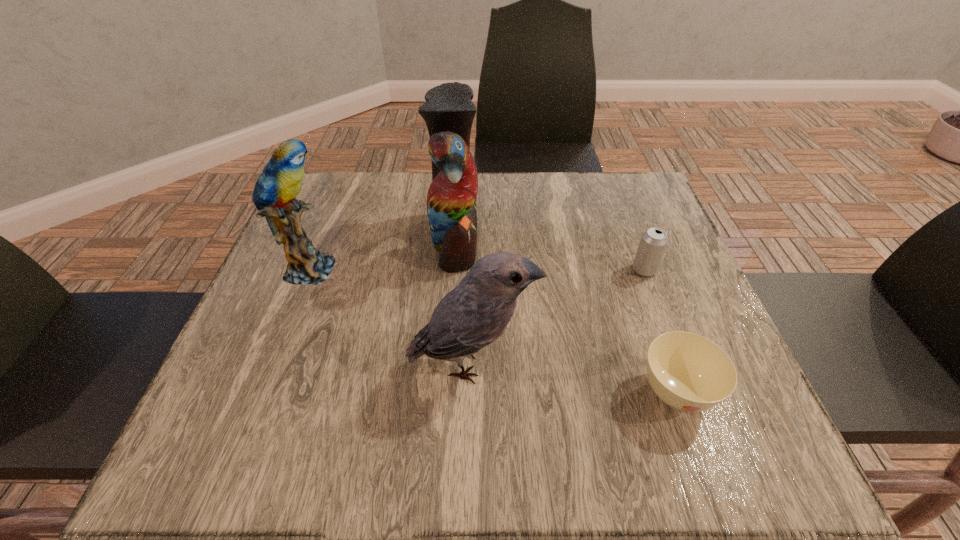
Where is `object at the near edge`? This screenshot has width=960, height=540. object at the near edge is located at coordinates (688, 372).

The image size is (960, 540). Find the location of `object that is at the left edge`. object that is at the left edge is located at coordinates (281, 181).

In order to click on beer can located in the right edge section of the desktop in this screenshot , I will do `click(653, 243)`.

The width and height of the screenshot is (960, 540). Find the location of `sugar bowl situated at the right edge`. sugar bowl situated at the right edge is located at coordinates (688, 372).

Identify the location of object that is at the near right corner. This screenshot has height=540, width=960. (688, 372).

At what (x,y) coordinates should I click in order to perform the action: click on free location at the far edge of the desktop. Please return your answer as a coordinate pair (x, y). The width and height of the screenshot is (960, 540). Looking at the image, I should click on (580, 173).

Where is `vacant space at the near edge of the desktop`? Image resolution: width=960 pixels, height=540 pixels. vacant space at the near edge of the desktop is located at coordinates (315, 469).

Find the location of a particular element. The height and width of the screenshot is (540, 960). free spot at the left edge of the desktop is located at coordinates (335, 263).

In the image, there is a desktop. Find the location of `vacant space at the right edge`. vacant space at the right edge is located at coordinates (652, 393).

This screenshot has height=540, width=960. Identify the location of free space at the far left corner of the desktop. (318, 172).